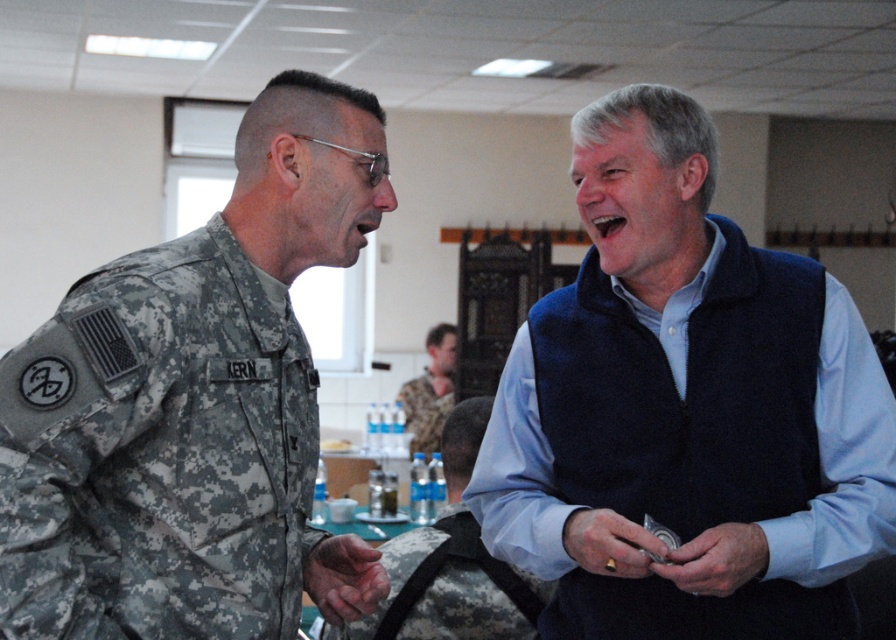
You are organizing a charity event and need to decide which of the two items, the blue fleece vest at center or the camouflage uniform at left, can be displayed on a standard mannequin that can only accommodate larger items. Which item should you choose?

The blue fleece vest at center is bigger than the camouflage uniform at left, so you should choose the blue fleece vest at center for display on the mannequin.

You are organizing a military event and need to place a name tag on the camouflage fabric bag at center. Where should you place it so that it is visible from the front and does not overlap with the camouflage uniform at left?

The camouflage uniform at left is positioned on the left side of the camouflage fabric bag at center. To ensure visibility and avoid overlap, place the name tag on the right side of the camouflage fabric bag at center.

In the scene shown: You are organizing a military event and need to ensure that the camouflage uniform at left and the camouflage fabric bag at center fit on a display table. The table has a width of 1.2 meters. Can both items be placed side by side without overlapping?

The camouflage uniform at left has a lesser width compared to the camouflage fabric bag at center. If the total width of both items combined is less than or equal to 1.2 meters, they can be placed side by side. However, without knowing the exact widths of each item, it is impossible to determine definitively.